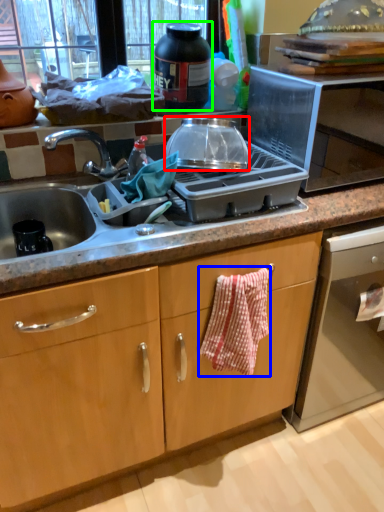
Question: Considering the real-world distances, which object is closest to kitchen appliance (highlighted by a red box)? hand towel (highlighted by a blue box) or kitchen appliance (highlighted by a green box).

Choices:
 (A) hand towel
 (B) kitchen appliance

Answer: (B)